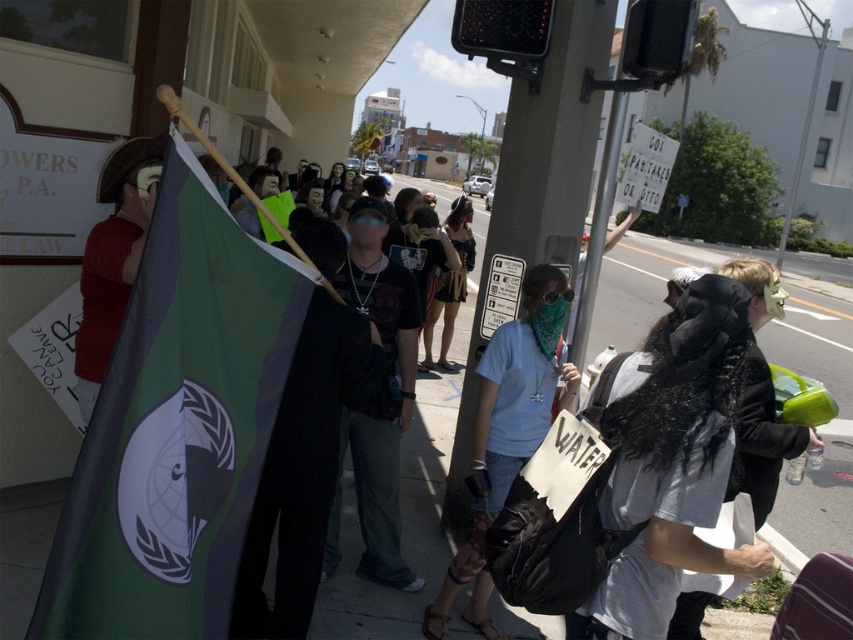
Does green fabric flag at left have a greater height compared to white cotton t-shirt at center?

Yes.

Does green fabric flag at left have a greater width compared to white cotton t-shirt at center?

Incorrect, green fabric flag at left's width does not surpass white cotton t-shirt at center's.

Describe the element at coordinates (177, 428) in the screenshot. The height and width of the screenshot is (640, 853). I see `green fabric flag at left` at that location.

Where is `green fabric flag at left`? The width and height of the screenshot is (853, 640). green fabric flag at left is located at coordinates (177, 428).

Who is more forward, (618, 525) or (764, 451)?

Point (618, 525) is more forward.

Can you confirm if white cotton t-shirt at center is positioned above fuzzy black coat at center?

Yes, white cotton t-shirt at center is above fuzzy black coat at center.

Between point (700, 572) and point (752, 436), which one is positioned in front?

Positioned in front is point (700, 572).

Identify the location of white cotton t-shirt at center. The height and width of the screenshot is (640, 853). (671, 461).

Can you confirm if green fabric flag at left is taller than red fuzzy sweater at left?

Yes.

Is green fabric flag at left closer to the viewer compared to red fuzzy sweater at left?

Yes, it is in front of red fuzzy sweater at left.

Does point (126, 465) come in front of point (91, 284)?

Yes, point (126, 465) is closer to viewer.

Identify the location of green fabric flag at left. The image size is (853, 640). (177, 428).